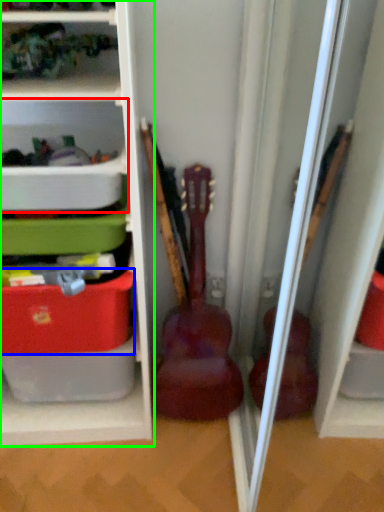
Question: Considering the real-world distances, which object is farthest from shelf (highlighted by a red box)? storage box (highlighted by a blue box) or shelf (highlighted by a green box)?

Choices:
 (A) storage box
 (B) shelf

Answer: (A)